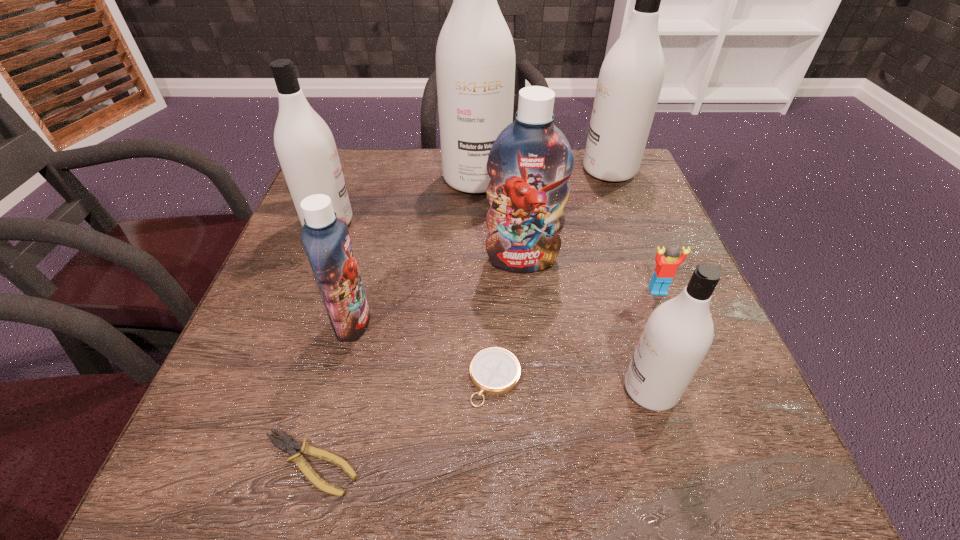
At what (x,y) coordinates should I click in order to perform the action: click on object identified as the second closest to the shortest object. Please return your answer as a coordinate pair (x, y). The height and width of the screenshot is (540, 960). Looking at the image, I should click on (495, 371).

I want to click on object that is the eighth closest one to the shortest object, so click(x=630, y=79).

Identify the location of shampoo that is the second closest one to the tallest shampoo. (630, 79).

At what (x,y) coordinates should I click in order to perform the action: click on the fifth closest shampoo relative to the sixth nearest object. Please return your answer as a coordinate pair (x, y). This screenshot has width=960, height=540. Looking at the image, I should click on (305, 146).

Find the location of a particular element. white shampoo identified as the fourth closest to the pliers is located at coordinates (630, 79).

Locate an element on the screen. This screenshot has height=540, width=960. white shampoo that is the second closest to the farther blue shampoo is located at coordinates (678, 334).

The width and height of the screenshot is (960, 540). I want to click on vacant area in the image that satisfies the following two spatial constraints: 1. on the front label of the bigger blue shampoo; 2. on the front label of the second nearest shampoo, so click(x=528, y=321).

Find the location of a particular element. This screenshot has height=540, width=960. free space that satisfies the following two spatial constraints: 1. on the front-facing side of the yellow pliers; 2. on the right side of the third biggest white shampoo is located at coordinates (234, 463).